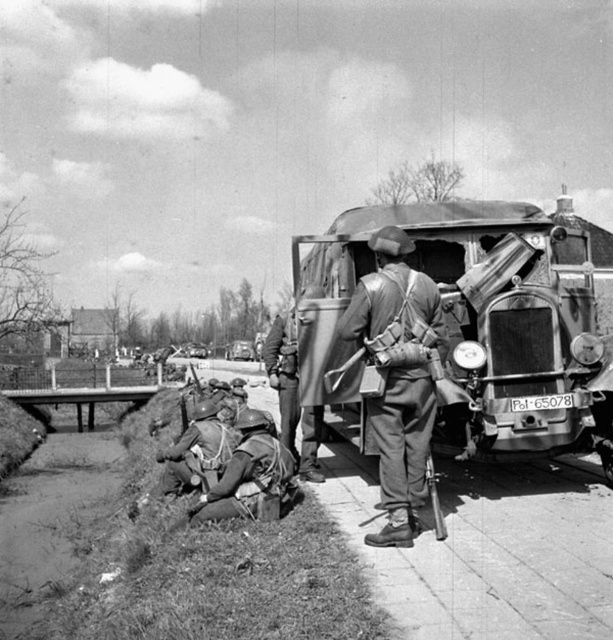
You are a soldier in the scene. You need to retrieve your camouflage fabric helmet at lower left. However, the metallic car at center is blocking your path. Can you move the helmet without moving the car?

The camouflage fabric helmet at lower left is positioned under the metallic car at center. Since the car is blocking the helmet, you would need to move the car first to access the helmet.

You are a soldier in the scene. You need to retrieve your smooth leather jacket at center to protect yourself from the rain. However, the camouflage fabric helmet at lower left is blocking your path. Can you reach your jacket without moving the helmet?

The smooth leather jacket at center is positioned over the camouflage fabric helmet at lower left, meaning the jacket is above the helmet. Since the jacket is already above the helmet, you can reach it without needing to move the helmet.

Based on the scene described, can you determine if the camouflage fabric helmet at lower left has a greater width than the metallic car at center?

The camouflage fabric helmet at lower left might be wider than metallic car at center according to the description.